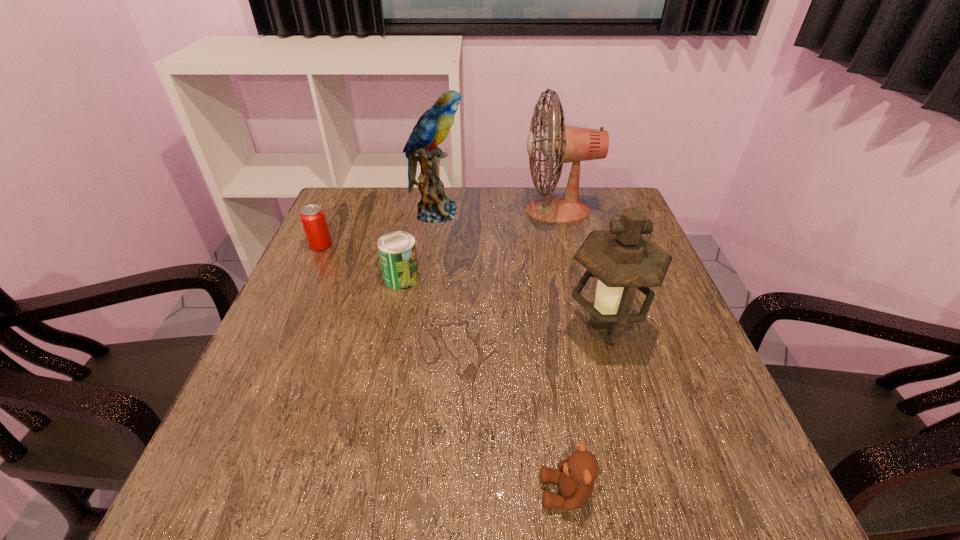
Find the location of `the closest object to the nearest object`. the closest object to the nearest object is located at coordinates (623, 260).

Identify the location of object that is the closest to the fan. The image size is (960, 540). (432, 128).

What are the coordinates of `vacant space that satisfies the following two spatial constraints: 1. on the face of the parrot; 2. on the right side of the oil lamp` in the screenshot? It's located at (420, 329).

Where is `free location that satisfies the following two spatial constraints: 1. in front of the fan to direct airflow; 2. on the left side of the third tallest object`? free location that satisfies the following two spatial constraints: 1. in front of the fan to direct airflow; 2. on the left side of the third tallest object is located at coordinates (587, 329).

This screenshot has width=960, height=540. What are the coordinates of `vacant position in the image that satisfies the following two spatial constraints: 1. on the back side of the fourth shortest object; 2. on the face of the parrot` in the screenshot? It's located at point(571,212).

At what (x,y) coordinates should I click in order to perform the action: click on vacant area that satisfies the following two spatial constraints: 1. on the face of the oil lamp; 2. on the right side of the parrot. Please return your answer as a coordinate pair (x, y). The height and width of the screenshot is (540, 960). Looking at the image, I should click on (420, 329).